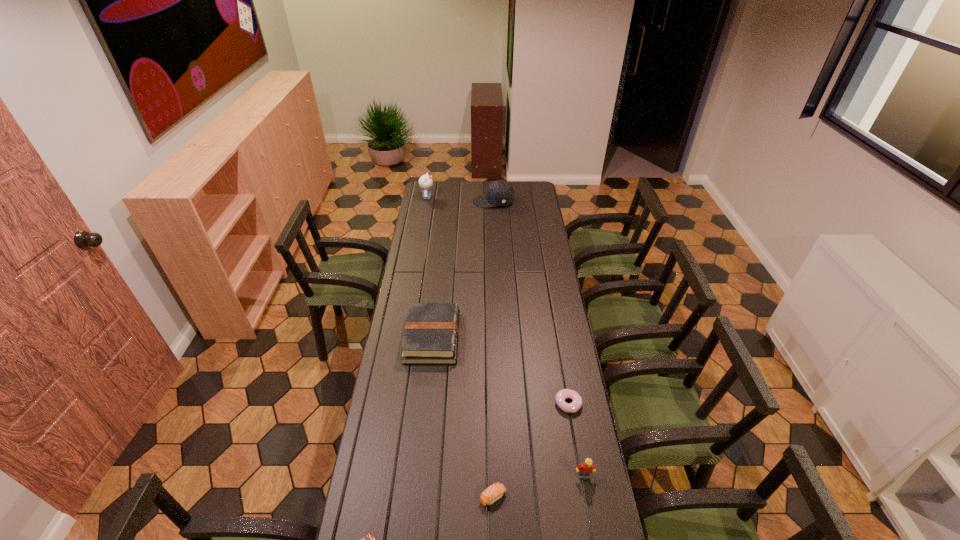
You are a GUI agent. You are given a task and a screenshot of the screen. Output one action in this format:
    pyautogui.click(x=<x>, y=<y>)
    Task: Click on the Lego that is at the right edge
    The height and width of the screenshot is (540, 960).
    Given the screenshot: What is the action you would take?
    pyautogui.click(x=585, y=469)

The height and width of the screenshot is (540, 960). I want to click on doughnut that is at the right edge, so click(x=575, y=405).

Where is `object at the far left corner`? Image resolution: width=960 pixels, height=540 pixels. object at the far left corner is located at coordinates (425, 182).

Identify the location of vacant space at the far edge of the desktop. (470, 196).

Image resolution: width=960 pixels, height=540 pixels. What are the coordinates of `vacant area at the left edge of the desktop` in the screenshot? It's located at (430, 273).

Find the location of `vacant space at the right edge`. vacant space at the right edge is located at coordinates (599, 502).

You are a GUI agent. You are given a task and a screenshot of the screen. Output one action in this format:
    pyautogui.click(x=<x>, y=<y>)
    Task: Click on the vacant area at the far left corner of the desktop
    The width and height of the screenshot is (960, 540).
    Given the screenshot: What is the action you would take?
    pyautogui.click(x=440, y=181)

In the image, there is a desktop. Where is `vacant space at the far right corner`? This screenshot has height=540, width=960. vacant space at the far right corner is located at coordinates (536, 189).

Find the location of a particular element. Image resolution: width=960 pixels, height=540 pixels. free area in between the baseball cap and the third farthest object is located at coordinates (463, 270).

Identify the location of vacant area that lies between the baseball cap and the kitten. The width and height of the screenshot is (960, 540). (461, 200).